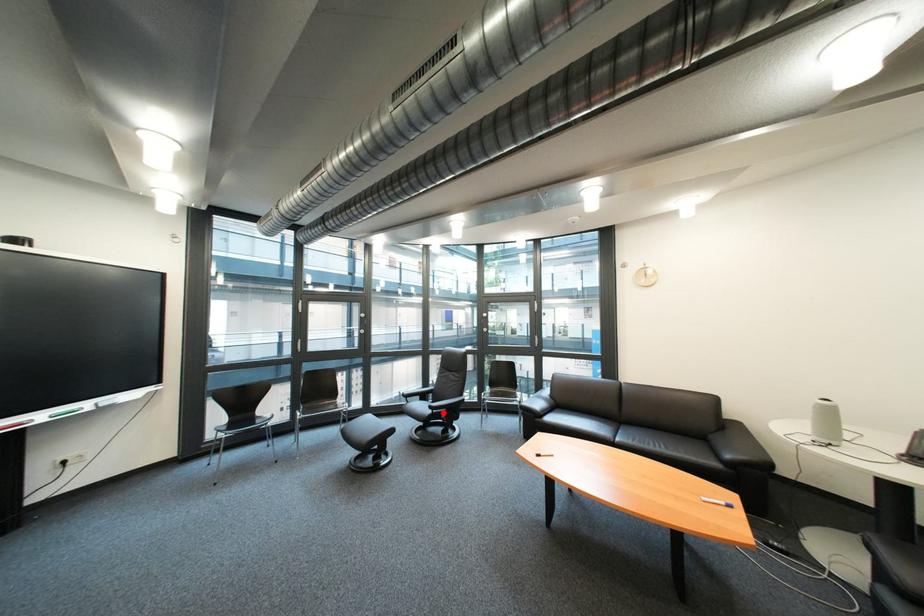
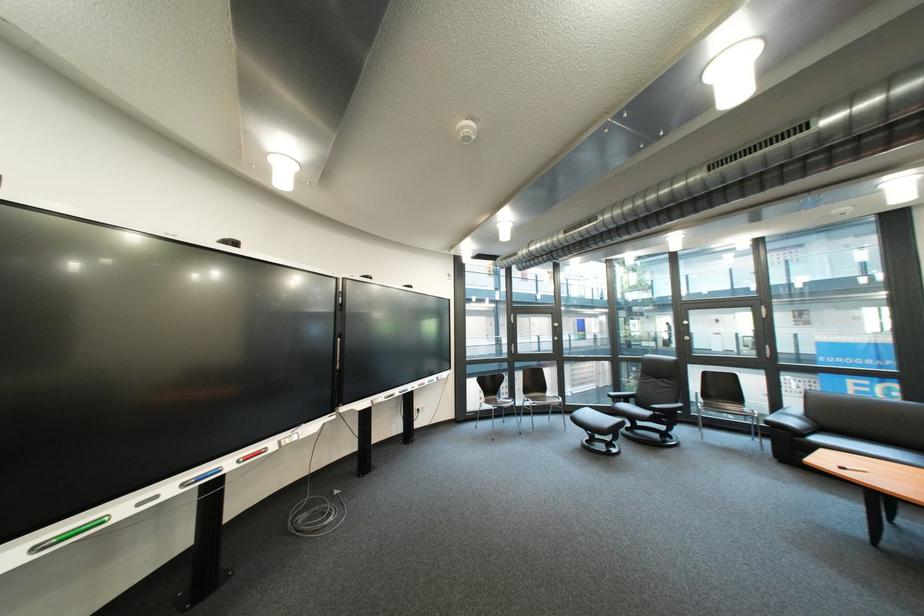
Question: I am providing you with two images of the same scene from different viewpoints. Given a red point in image1, look at the same physical point in image2. Is it:

Choices:
 (A) Closer to the viewpoint
 (B) Farther from the viewpoint

Answer: (A)